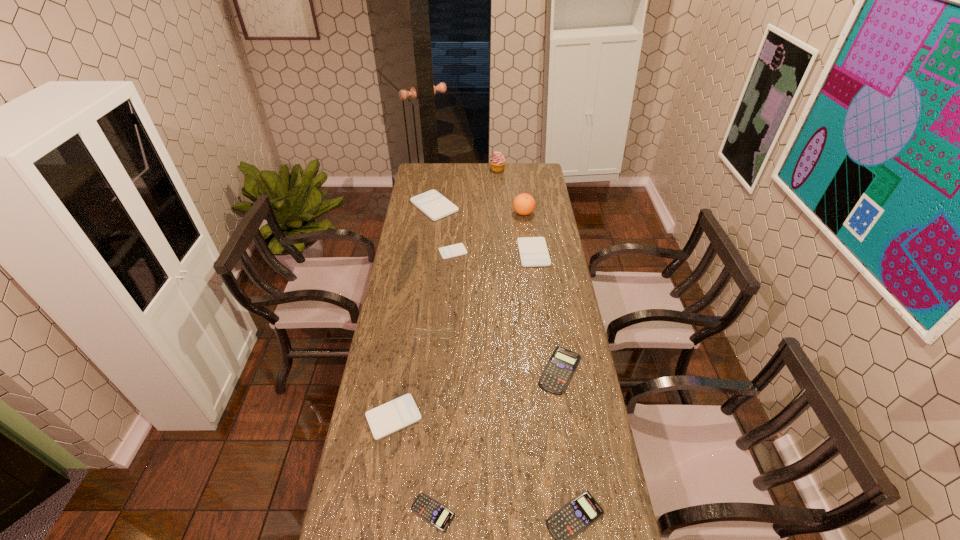
Find the location of `the fifth shortest object`. the fifth shortest object is located at coordinates (392, 416).

Locate an element on the screen. The width and height of the screenshot is (960, 540). the smallest white calculator is located at coordinates (455, 250).

Locate an element on the screen. Image resolution: width=960 pixels, height=540 pixels. the farthest blue calculator is located at coordinates (560, 368).

Where is `the leftmost blue calculator`? The height and width of the screenshot is (540, 960). the leftmost blue calculator is located at coordinates (430, 510).

You are a GUI agent. You are given a task and a screenshot of the screen. Output one action in this format:
    pyautogui.click(x=<x>, y=<y>)
    Task: Click on the shortest object
    Image resolution: width=960 pixels, height=540 pixels.
    Given the screenshot: What is the action you would take?
    pyautogui.click(x=430, y=510)

Where is `free space located 0.270m on the left of the farthest object`? free space located 0.270m on the left of the farthest object is located at coordinates (443, 170).

Where is `vacant space located 0.080m on the back of the orange orange`? This screenshot has width=960, height=540. vacant space located 0.080m on the back of the orange orange is located at coordinates (521, 199).

Locate an element on the screen. This screenshot has width=960, height=540. free space located 0.240m on the front-facing side of the spectacles is located at coordinates (427, 396).

Image resolution: width=960 pixels, height=540 pixels. Identify the location of vacant space located 0.300m on the back of the seventh shortest object. (440, 165).

In order to click on free spot located on the back of the fifth tallest object in this screenshot , I will do `click(526, 198)`.